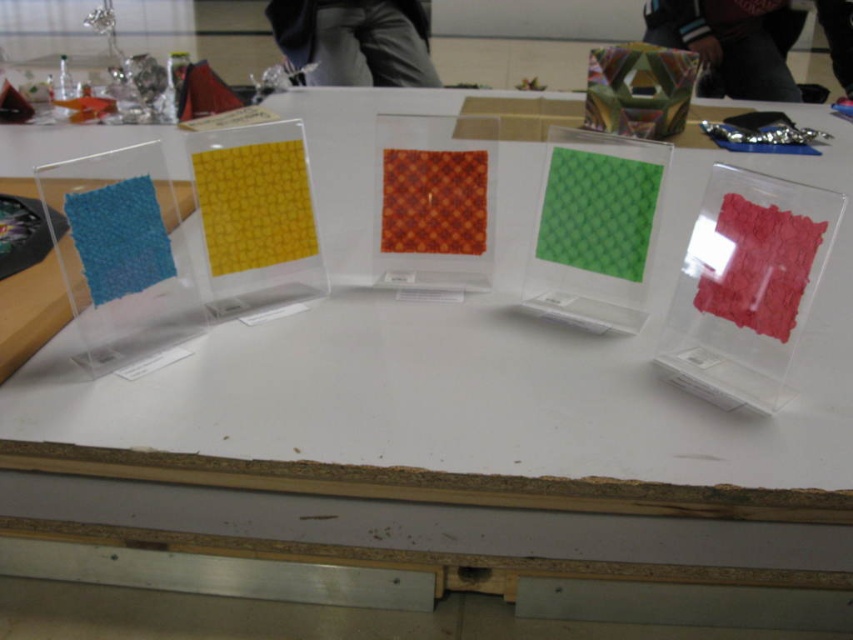
Question: Can you confirm if orange woven fabric at center is bigger than matte red fabric at center?

Choices:
 (A) no
 (B) yes

Answer: (B)

Question: In this image, where is yellow textured paper at center located relative to metallic hexagonal prism at upper center?

Choices:
 (A) left
 (B) right

Answer: (A)

Question: Which point is farther to the camera?

Choices:
 (A) matte red fabric at center
 (B) yellow textured paper at center
 (C) orange woven fabric at center

Answer: (C)

Question: Based on their relative distances, which object is nearer to the yellow textured paper at center?

Choices:
 (A) matte red fabric at center
 (B) orange woven fabric at center
 (C) metallic hexagonal prism at upper center

Answer: (B)

Question: Which point is farther from the camera taking this photo?

Choices:
 (A) (271, 246)
 (B) (628, 125)

Answer: (B)

Question: In this image, where is yellow textured paper at center located relative to matte red fabric at center?

Choices:
 (A) right
 (B) left

Answer: (B)